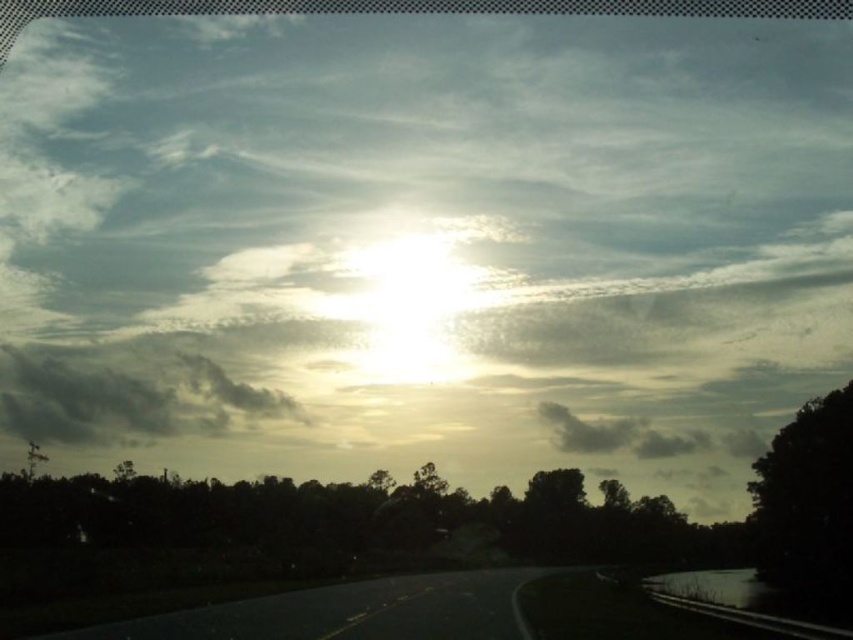
Question: Among these objects, which one is nearest to the camera?

Choices:
 (A) silhouette leafy tree at lower center
 (B) dark gray fluffy cloud at upper center

Answer: (A)

Question: Which point is farther to the camera?

Choices:
 (A) (357, 484)
 (B) (833, 435)

Answer: (A)

Question: In this image, where is dark green leafy tree at right located relative to dark gray fluffy cloud at upper center?

Choices:
 (A) left
 (B) right

Answer: (A)

Question: Can you confirm if silhouette leafy tree at lower center is positioned to the right of dark gray fluffy cloud at upper center?

Choices:
 (A) no
 (B) yes

Answer: (A)

Question: Which object is farther from the camera taking this photo?

Choices:
 (A) dark green leafy tree at right
 (B) silhouette leafy tree at lower center
 (C) dark gray fluffy cloud at upper center

Answer: (C)

Question: Is dark green leafy tree at right positioned in front of dark gray fluffy cloud at upper center?

Choices:
 (A) yes
 (B) no

Answer: (A)